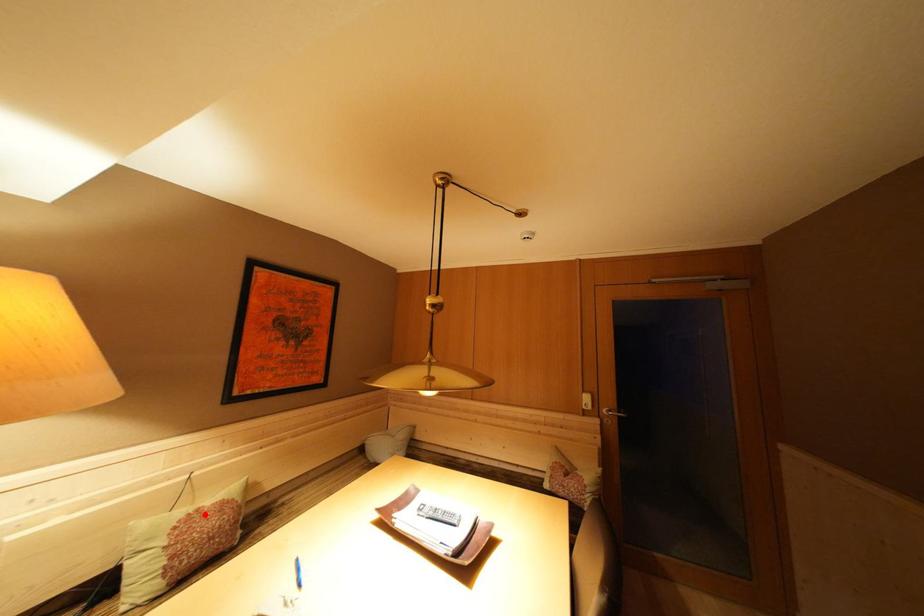
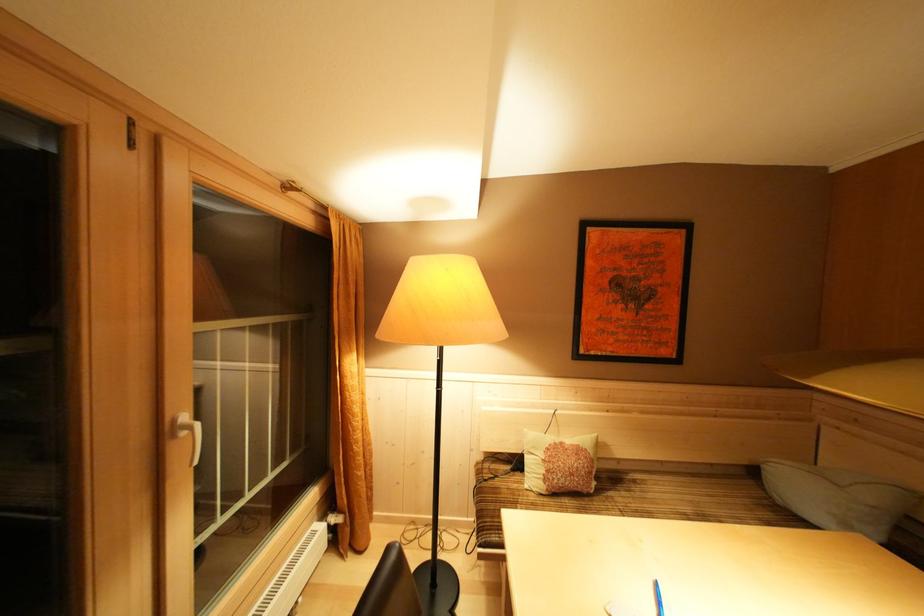
Locate, in the second image, the point that corresponds to the highlighted location in the first image.

(568, 448)